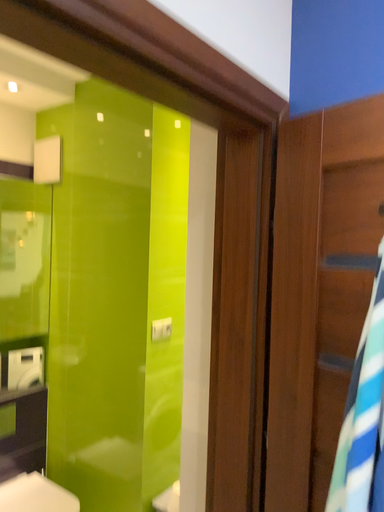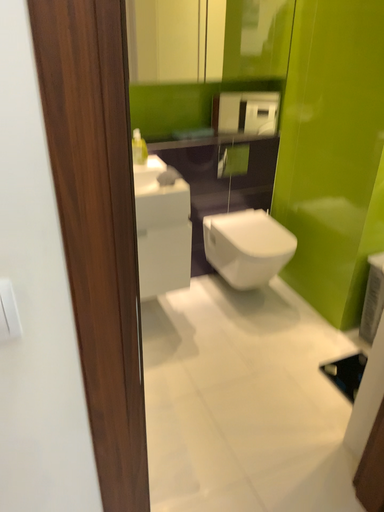
Question: How did the camera likely rotate when shooting the video?

Choices:
 (A) rotated downward
 (B) rotated upward

Answer: (A)